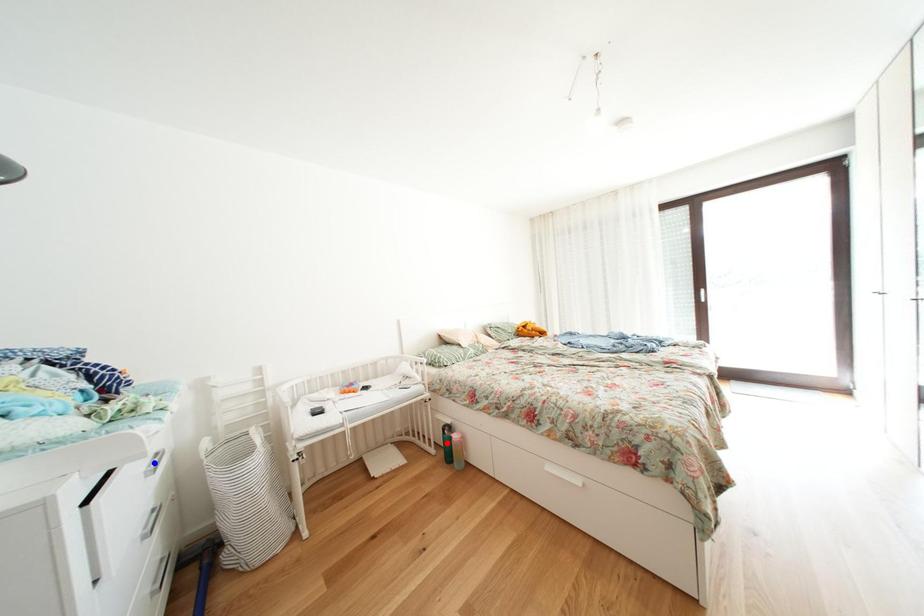
Question: Which of the two points in the image is closer to the camera?

Choices:
 (A) Blue point is closer.
 (B) Red point is closer.

Answer: (A)